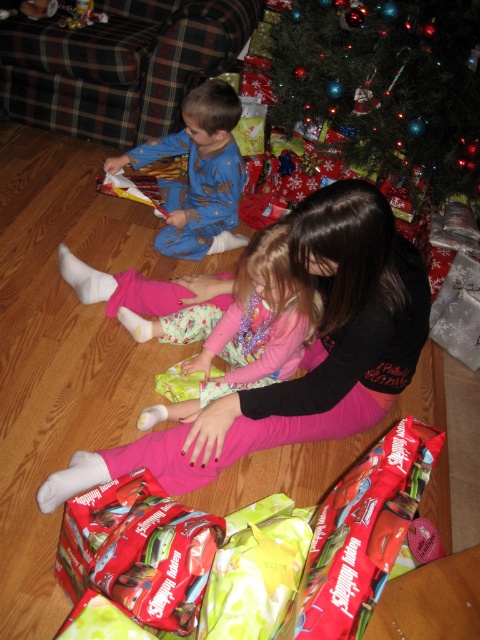
Question: Which object is closer to the camera taking this photo?

Choices:
 (A) blue pajama at center
 (B) green matte christmas tree at upper center
 (C) pink matte/black sweater at center

Answer: (C)

Question: Is green matte christmas tree at upper center to the right of blue pajama at center from the viewer's perspective?

Choices:
 (A) no
 (B) yes

Answer: (B)

Question: Is the position of pink satin dress at center less distant than that of blue pajama at center?

Choices:
 (A) yes
 (B) no

Answer: (A)

Question: Does pink matte/black sweater at center have a greater width compared to green matte christmas tree at upper center?

Choices:
 (A) yes
 (B) no

Answer: (A)

Question: Which of the following is the farthest from the observer?

Choices:
 (A) (243, 264)
 (B) (228, 156)

Answer: (B)

Question: Which point is farther from the camera taking this photo?

Choices:
 (A) (210, 152)
 (B) (368, 227)
 (C) (400, 131)

Answer: (A)